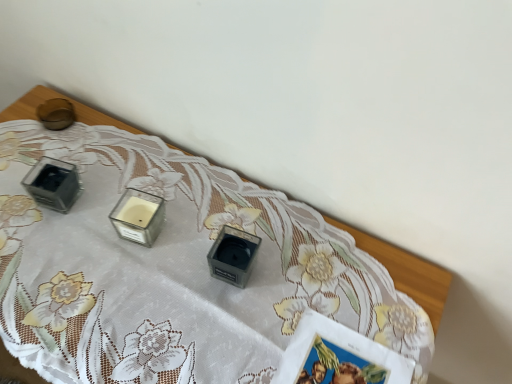
The image size is (512, 384). I want to click on free spot above matte glass candle at upper left (from a real-world perspective), so click(x=154, y=244).